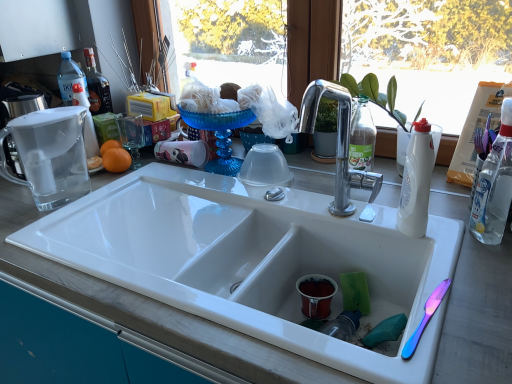
You are a GUI agent. You are given a task and a screenshot of the screen. Output one action in this format:
    pyautogui.click(x=<x>, y=<y>)
    Task: Click on the free space above white ceramic sink at center (from a real-world perspective)
    This screenshot has height=384, width=512.
    Given the screenshot: What is the action you would take?
    [186, 202]